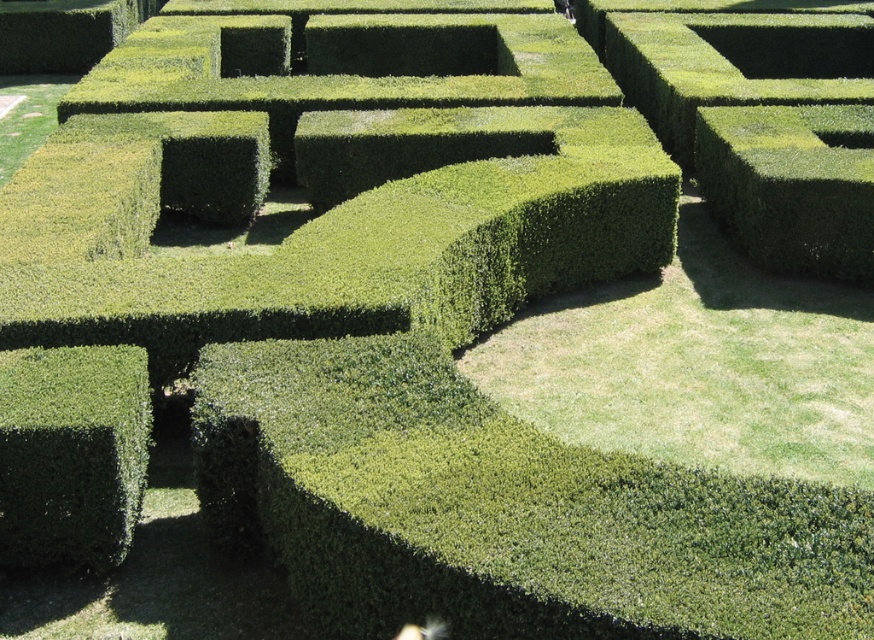
Who is positioned more to the left, green textured hedge at lower left or green textured hedge at upper right?

green textured hedge at lower left

The image size is (874, 640). I want to click on green textured hedge at lower left, so click(71, 452).

At what (x,y) coordinates should I click in order to perform the action: click on green textured hedge at lower left. Please return your answer as a coordinate pair (x, y). Image resolution: width=874 pixels, height=640 pixels. Looking at the image, I should click on (71, 452).

Image resolution: width=874 pixels, height=640 pixels. Identify the location of green textured hedge at lower left. (71, 452).